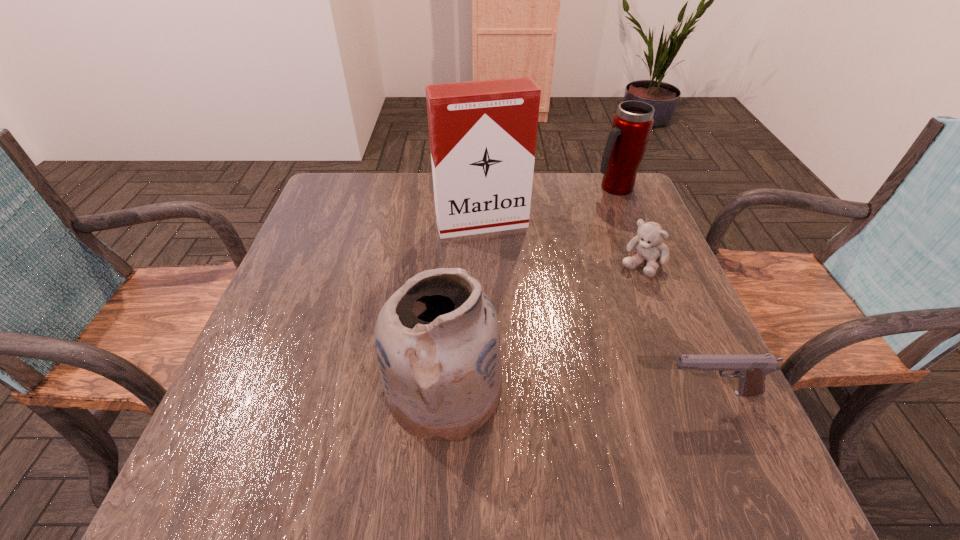
This screenshot has height=540, width=960. Identify the location of free space located 0.180m at the barrel of the pistol. (564, 393).

What are the coordinates of `vacant space located on the face of the third nearest object` in the screenshot? It's located at (621, 292).

The width and height of the screenshot is (960, 540). Find the location of `free region located 0.130m on the face of the third nearest object`. free region located 0.130m on the face of the third nearest object is located at coordinates [607, 310].

At what (x,y) coordinates should I click in order to perform the action: click on vacant region located on the face of the third nearest object. Please return your answer as a coordinate pair (x, y). This screenshot has width=960, height=540. Looking at the image, I should click on (607, 310).

Where is `vacant point located on the side with the handle of the thermos bottle`? vacant point located on the side with the handle of the thermos bottle is located at coordinates (610, 206).

Identify the location of vacant space located on the side with the handle of the thermos bottle. The height and width of the screenshot is (540, 960). (608, 225).

Find the location of a particular element. This screenshot has width=960, height=540. vacant space positioned on the side with the handle of the thermos bottle is located at coordinates (608, 225).

The width and height of the screenshot is (960, 540). I want to click on vacant point located 0.210m on the front-facing side of the fourth nearest object, so click(513, 296).

At what (x,y) coordinates should I click in order to perform the action: click on blank space located on the front-facing side of the fourth nearest object. Please return your answer as a coordinate pair (x, y). Looking at the image, I should click on (525, 331).

This screenshot has width=960, height=540. In order to click on vacant space located 0.280m on the front-facing side of the fourth nearest object in this screenshot , I will do `click(521, 320)`.